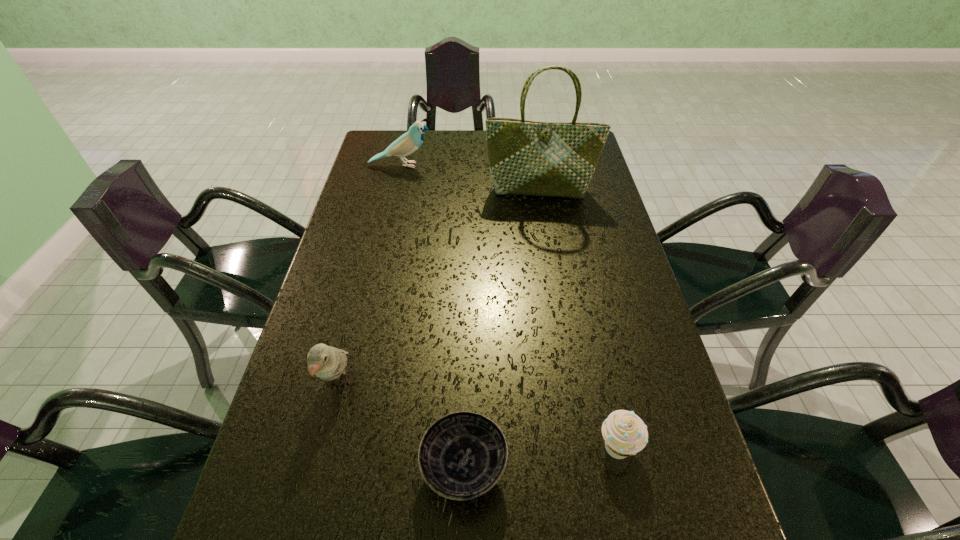
Find the location of a particular element. vacant space located on the right of the shortest object is located at coordinates (624, 468).

What are the coordinates of `object located in the far edge section of the desktop` in the screenshot? It's located at (409, 142).

The width and height of the screenshot is (960, 540). What are the coordinates of `shopping bag positioned at the right edge` in the screenshot? It's located at (525, 157).

Where is `muffin positioned at the right edge`? The height and width of the screenshot is (540, 960). muffin positioned at the right edge is located at coordinates (x=625, y=434).

The height and width of the screenshot is (540, 960). In order to click on object located in the far left corner section of the desktop in this screenshot , I will do `click(409, 142)`.

Locate an element on the screen. The image size is (960, 540). vacant space at the far edge of the desktop is located at coordinates (470, 134).

You are a GUI agent. You are given a task and a screenshot of the screen. Output one action in this format:
    pyautogui.click(x=<x>, y=<y>)
    Task: Click on the vacant space at the left edge
    This screenshot has width=960, height=540.
    Given the screenshot: What is the action you would take?
    pyautogui.click(x=329, y=401)

This screenshot has width=960, height=540. Find the location of `free space at the right edge`. free space at the right edge is located at coordinates click(x=643, y=330).

Locate an element on the screen. The height and width of the screenshot is (540, 960). free space at the far left corner is located at coordinates (390, 157).

The height and width of the screenshot is (540, 960). I want to click on free space between the third nearest object and the farther bird, so click(370, 275).